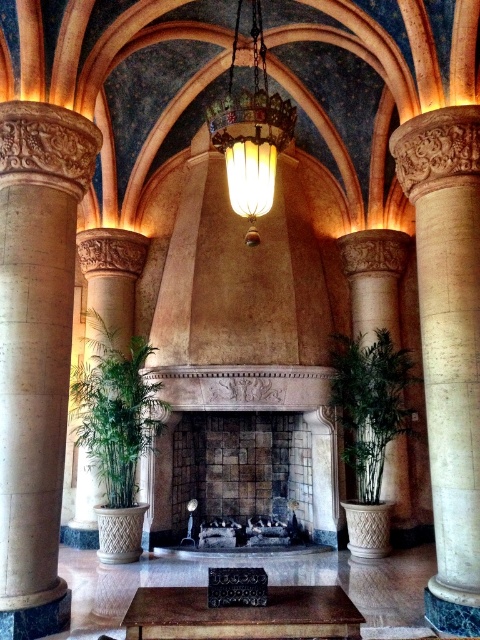
Question: Which point is farther from the camera taking this photo?

Choices:
 (A) (361, 352)
 (B) (400, 513)
 (C) (73, 403)

Answer: (C)

Question: Estimate the real-world distances between objects in this image. Which object is farther from the matte gold chandelier at center?

Choices:
 (A) beige stone column at center
 (B) beige stone column at left
 (C) stone fireplace at center
 (D) green leafy plant at right

Answer: (D)

Question: Which object appears closest to the camera in this image?

Choices:
 (A) beige stone column at left
 (B) stone fireplace at center
 (C) matte gold chandelier at center
 (D) green leafy plant at right

Answer: (C)

Question: Does beige stone column at left appear on the left side of matte gold chandelier at center?

Choices:
 (A) yes
 (B) no

Answer: (A)

Question: From the image, what is the correct spatial relationship of beige stone column at left in relation to green leafy plant at left?

Choices:
 (A) below
 (B) above

Answer: (B)

Question: Is stone fireplace at center smaller than green leafy plant at right?

Choices:
 (A) no
 (B) yes

Answer: (A)